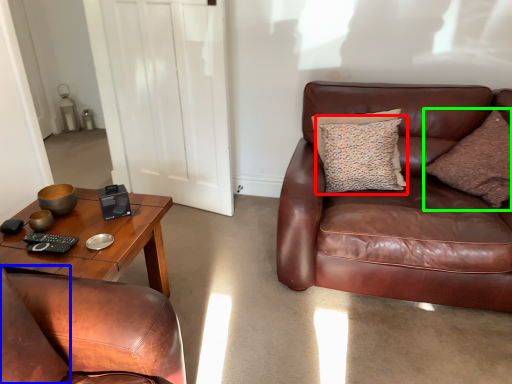
Question: Which is farther away from pillow (highlighted by a red box)? pillow (highlighted by a blue box) or pillow (highlighted by a green box)?

Choices:
 (A) pillow
 (B) pillow

Answer: (A)